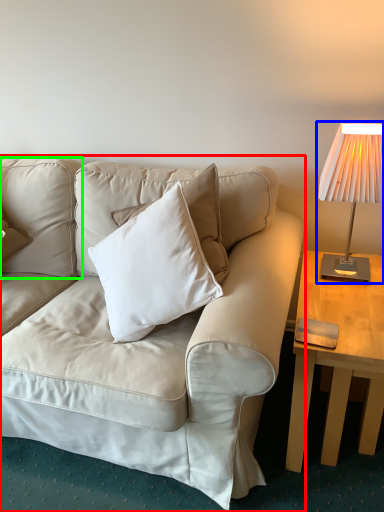
Question: Estimate the real-world distances between objects in this image. Which object is farther from studio couch (highlighted by a red box), lamp (highlighted by a blue box) or pillow (highlighted by a green box)?

Choices:
 (A) lamp
 (B) pillow

Answer: (A)